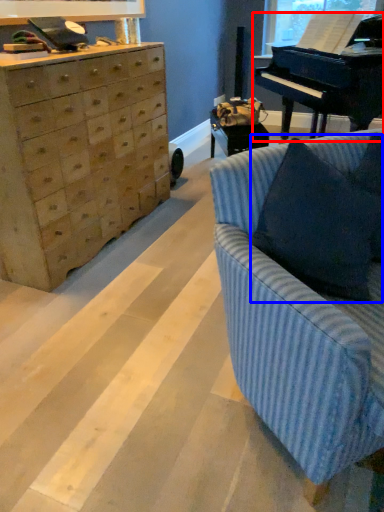
Question: Among these objects, which one is nearest to the camera, piano (highlighted by a red box) or pillow (highlighted by a blue box)?

Choices:
 (A) piano
 (B) pillow

Answer: (B)